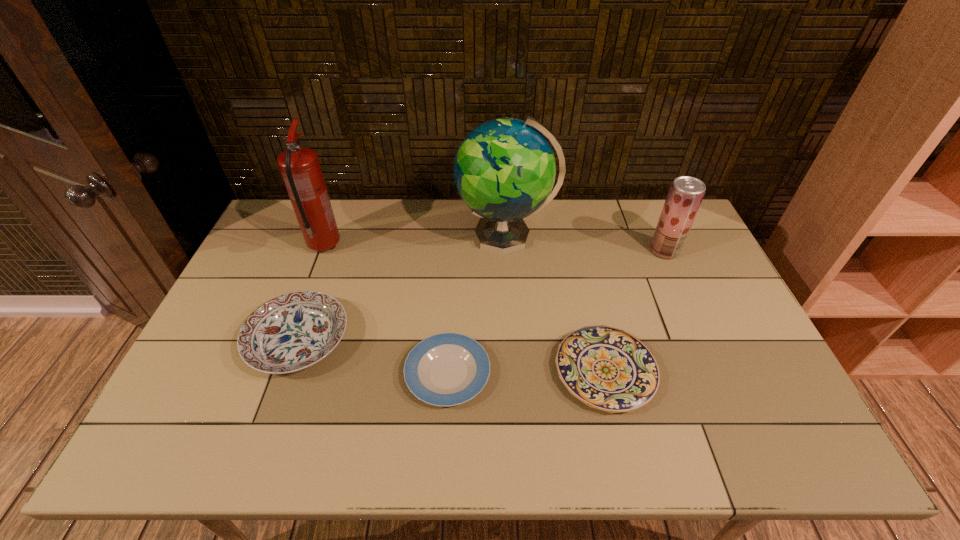
Find the location of a particular element. globe is located at coordinates (504, 170).

Find the location of `fire extinguisher`. fire extinguisher is located at coordinates (299, 166).

Where is `the third tallest object`? The width and height of the screenshot is (960, 540). the third tallest object is located at coordinates (686, 193).

This screenshot has width=960, height=540. Find the location of `fruit juice`. fruit juice is located at coordinates (686, 193).

Identify the location of the leftmost plate. (293, 331).

At what (x,y) coordinates should I click in order to perform the action: click on the fourth tallest object. Please return your answer as a coordinate pair (x, y). The width and height of the screenshot is (960, 540). Looking at the image, I should click on (293, 331).

Locate an element on the screen. the rightmost plate is located at coordinates (606, 368).

The height and width of the screenshot is (540, 960). What are the coordinates of `the second plate from left to right` in the screenshot? It's located at (447, 369).

This screenshot has width=960, height=540. In order to click on blank space located on the front surface of the globe in this screenshot , I will do `click(364, 236)`.

Identify the location of vacant point located 0.380m on the front surface of the globe. (347, 236).